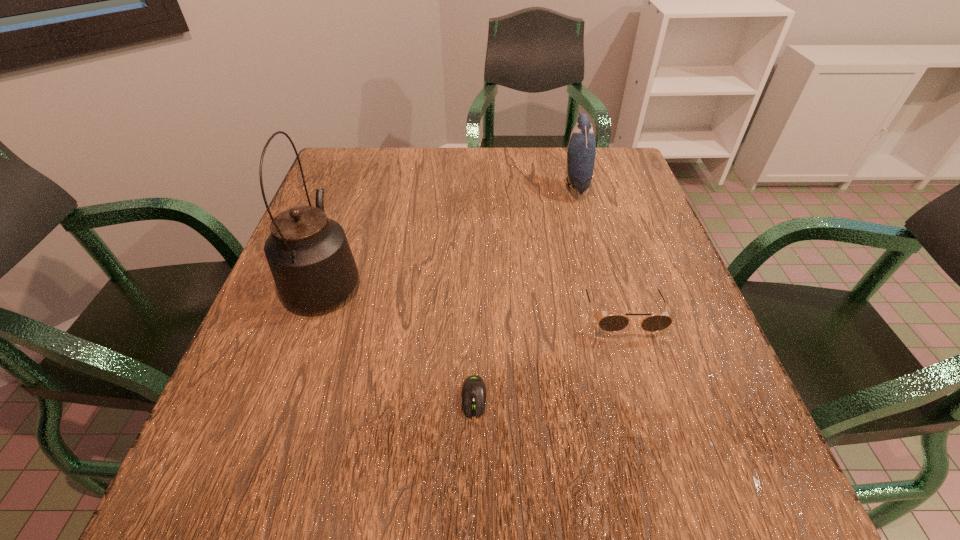
You are a GUI agent. You are given a task and a screenshot of the screen. Output one action in this format:
    pyautogui.click(x=<x>, y=<y>)
    Task: Click on the vacant area that lies between the bird and the sunglasses
    Image resolution: width=960 pixels, height=540 pixels.
    Given the screenshot: What is the action you would take?
    pyautogui.click(x=598, y=249)

You are a GUI agent. You are given a task and a screenshot of the screen. Output one action in this format:
    pyautogui.click(x=<x>, y=<y>)
    Task: Click on the vacant space that is in between the leftmost object and the second shortest object
    
    Given the screenshot: What is the action you would take?
    pyautogui.click(x=473, y=296)

Image resolution: width=960 pixels, height=540 pixels. I want to click on vacant area that lies between the farthest object and the kettle, so click(450, 232).

Identify the location of empty location between the third tallest object and the farthest object. (598, 249).

This screenshot has height=540, width=960. I want to click on free space between the second object from left to right and the sunglasses, so click(548, 355).

Locate an element on the screen. Image resolution: width=960 pixels, height=540 pixels. vacant area between the sunglasses and the third object from right to left is located at coordinates (548, 355).

Locate which object ranks third in proximity to the computer mouse. Please provide its 2D coordinates. Your answer should be formatted as a tuple, i.e. [(x, y)], where the tuple contains the x and y coordinates of a point satisfying the conditions above.

[(581, 150)]

Locate which object is the second closest to the bird. Please provide its 2D coordinates. Your answer should be formatted as a tuple, i.e. [(x, y)], where the tuple contains the x and y coordinates of a point satisfying the conditions above.

[(309, 256)]